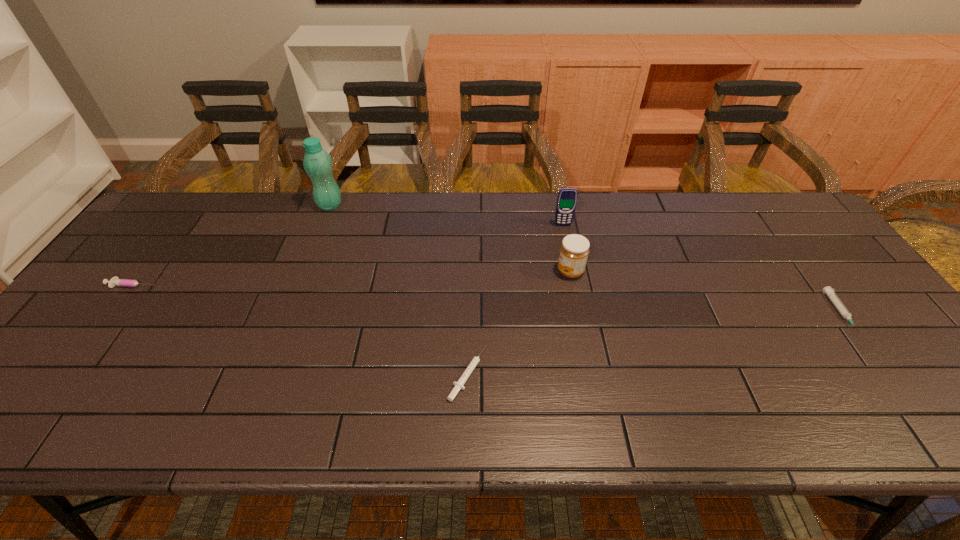
Identify the location of the farthest object. This screenshot has width=960, height=540. (317, 163).

You are a GUI agent. You are given a task and a screenshot of the screen. Output one action in this format:
    pyautogui.click(x=<x>, y=<y>)
    Task: Click on the bottle
    This screenshot has width=960, height=540.
    Given the screenshot: What is the action you would take?
    pyautogui.click(x=317, y=163)

This screenshot has width=960, height=540. I want to click on the second tallest object, so [x=567, y=197].

Identify the location of cellular telephone. (567, 197).

You are a GUI agent. You are given a task and a screenshot of the screen. Output one action in this format:
    pyautogui.click(x=<x>, y=<y>)
    Task: Click on the third tallest object
    This screenshot has width=960, height=540.
    Given the screenshot: What is the action you would take?
    pyautogui.click(x=574, y=250)

At what (x,y) coordinates should I click in order to perform the action: click on the leftmost syringe. Please return your answer as a coordinate pair (x, y). Looking at the image, I should click on (115, 281).

The height and width of the screenshot is (540, 960). I want to click on the leftmost object, so click(115, 281).

Where is `the second nearest object`? The height and width of the screenshot is (540, 960). the second nearest object is located at coordinates (829, 291).

The image size is (960, 540). I want to click on the rightmost object, so click(x=829, y=291).

Locate an element on the screen. Image resolution: width=960 pixels, height=540 pixels. the nearest syringe is located at coordinates (459, 384).